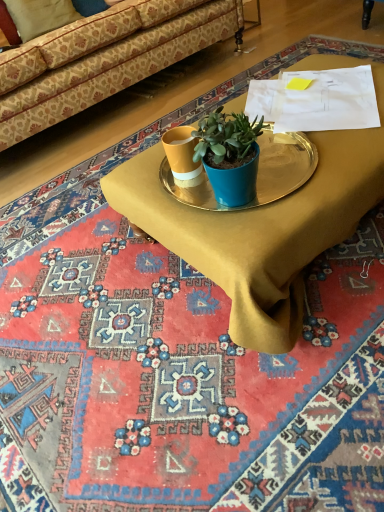
Question: Should I look upward or downward to see metallic gold tray at center?

Choices:
 (A) up
 (B) down

Answer: (A)

Question: Is metallic gold tray at center in contact with metallic gold tray at center?

Choices:
 (A) yes
 (B) no

Answer: (B)

Question: From the image's perspective, is metallic gold tray at center located beneath metallic gold tray at center?

Choices:
 (A) no
 (B) yes

Answer: (B)

Question: Does metallic gold tray at center come in front of metallic gold tray at center?

Choices:
 (A) yes
 (B) no

Answer: (B)

Question: Is metallic gold tray at center smaller than metallic gold tray at center?

Choices:
 (A) no
 (B) yes

Answer: (B)

Question: Is metallic gold tray at center thinner than metallic gold tray at center?

Choices:
 (A) yes
 (B) no

Answer: (A)

Question: Is metallic gold tray at center outside of metallic gold tray at center?

Choices:
 (A) no
 (B) yes

Answer: (B)

Question: Can you confirm if beige fabric pillow at upper left is positioned to the left of patterned fabric couch at upper left?

Choices:
 (A) yes
 (B) no

Answer: (A)

Question: From the image's perspective, would you say beige fabric pillow at upper left is shown under patterned fabric couch at upper left?

Choices:
 (A) no
 (B) yes

Answer: (A)

Question: Is patterned fabric couch at upper left inside beige fabric pillow at upper left?

Choices:
 (A) yes
 (B) no

Answer: (B)

Question: Is beige fabric pillow at upper left positioned in front of patterned fabric couch at upper left?

Choices:
 (A) yes
 (B) no

Answer: (B)

Question: Is beige fabric pillow at upper left beside patterned fabric couch at upper left?

Choices:
 (A) no
 (B) yes

Answer: (A)

Question: Does beige fabric pillow at upper left have a greater height compared to patterned fabric couch at upper left?

Choices:
 (A) no
 (B) yes

Answer: (A)

Question: Could you tell me if patterned fabric couch at upper left is turned towards metallic gold tray at center?

Choices:
 (A) no
 (B) yes

Answer: (B)